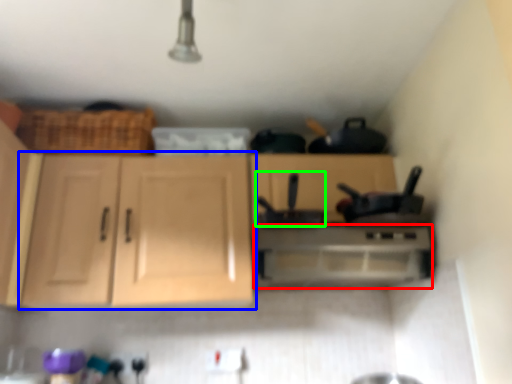
Question: Which is nearer to the home appliance (highlighted by a red box)? cabinetry (highlighted by a blue box) or appliance (highlighted by a green box).

Choices:
 (A) cabinetry
 (B) appliance

Answer: (B)